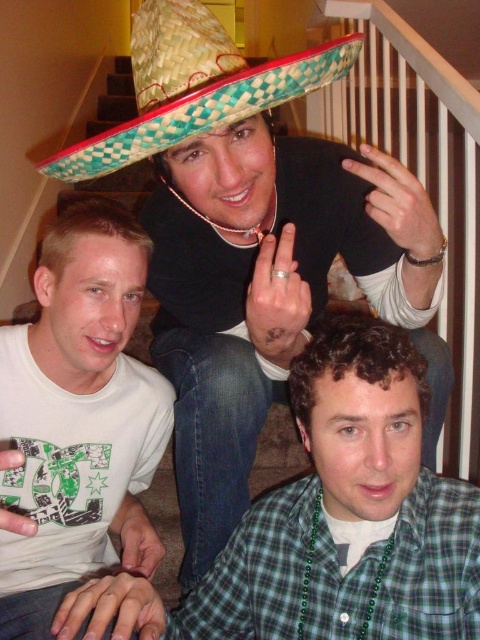
Question: Which object is positioned farthest from the white printed t-shirt at lower left?

Choices:
 (A) woven straw sombrero at upper center
 (B) green plaid shirt at lower right

Answer: (A)

Question: Does green plaid shirt at lower right appear over woven straw sombrero at upper center?

Choices:
 (A) yes
 (B) no

Answer: (B)

Question: Estimate the real-world distances between objects in this image. Which object is closer to the white printed t-shirt at lower left?

Choices:
 (A) woven straw sombrero at upper center
 (B) green plaid shirt at lower right

Answer: (B)

Question: Estimate the real-world distances between objects in this image. Which object is closer to the woven straw sombrero at upper center?

Choices:
 (A) green plaid shirt at lower right
 (B) white printed t-shirt at lower left

Answer: (B)

Question: In this image, where is white printed t-shirt at lower left located relative to woven straw sombrero at upper center?

Choices:
 (A) above
 (B) below

Answer: (B)

Question: Is white printed t-shirt at lower left below woven straw sombrero at upper center?

Choices:
 (A) no
 (B) yes

Answer: (B)